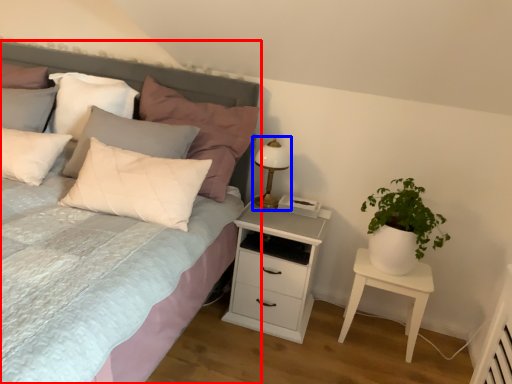
Question: Which point is closer to the camera, bed (highlighted by a red box) or bedside lamp (highlighted by a blue box)?

Choices:
 (A) bed
 (B) bedside lamp

Answer: (A)